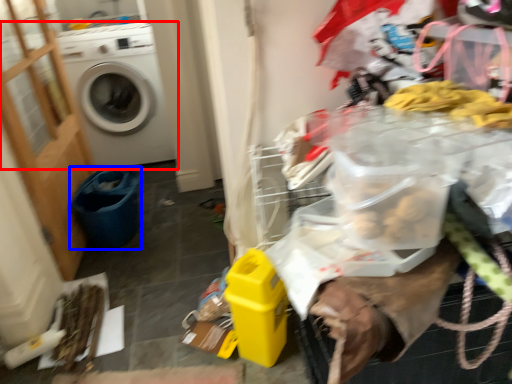
Question: Which object appears closest to the camera in this image, washing machine (highlighted by a red box) or recycling bin (highlighted by a blue box)?

Choices:
 (A) washing machine
 (B) recycling bin

Answer: (B)